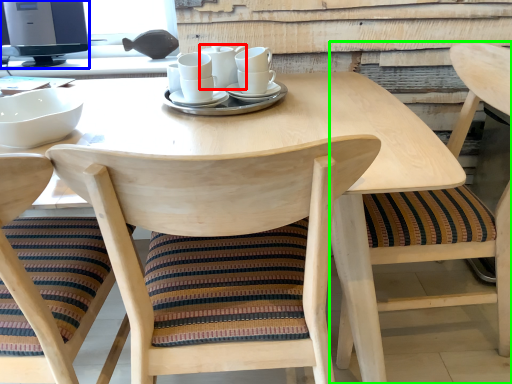
Question: Which object is the closest to the tableware (highlighted by a red box)? Choose among these: computer monitor (highlighted by a blue box) or chair (highlighted by a green box).

Choices:
 (A) computer monitor
 (B) chair

Answer: (B)